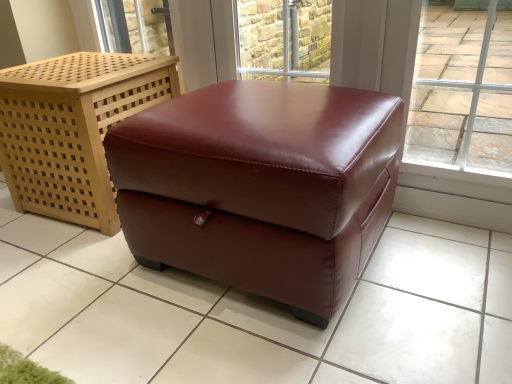
Where is `free point above burgundy leather ottoman at center (from a real-world perspective)`? The height and width of the screenshot is (384, 512). free point above burgundy leather ottoman at center (from a real-world perspective) is located at coordinates (76, 63).